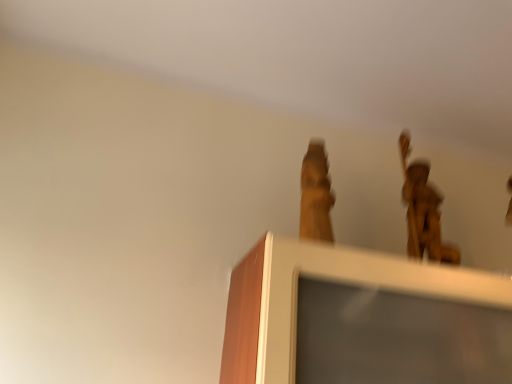
Question: Based on their sizes in the image, would you say bronze statue at upper right is bigger or smaller than wooden frame at upper center?

Choices:
 (A) big
 (B) small

Answer: (B)

Question: Which is correct: bronze statue at upper right is inside wooden frame at upper center, or outside of it?

Choices:
 (A) inside
 (B) outside

Answer: (B)

Question: Does point (406, 145) appear closer or farther from the camera than point (426, 354)?

Choices:
 (A) farther
 (B) closer

Answer: (A)

Question: Do you think wooden frame at upper center is within bronze statue at upper right, or outside of it?

Choices:
 (A) outside
 (B) inside

Answer: (A)

Question: From a real-world perspective, relative to bronze statue at upper right, is wooden frame at upper center vertically above or below?

Choices:
 (A) above
 (B) below

Answer: (B)

Question: From the image's perspective, is wooden frame at upper center located above or below bronze statue at upper right?

Choices:
 (A) above
 (B) below

Answer: (B)

Question: From their relative heights in the image, would you say wooden frame at upper center is taller or shorter than bronze statue at upper right?

Choices:
 (A) short
 (B) tall

Answer: (A)